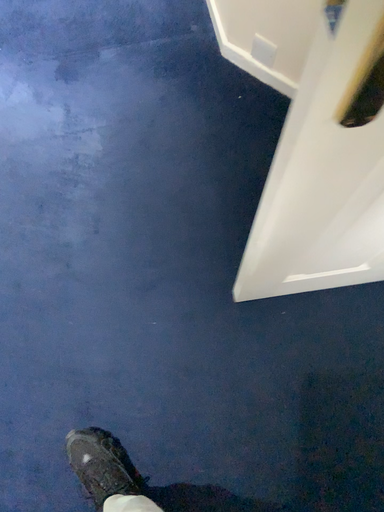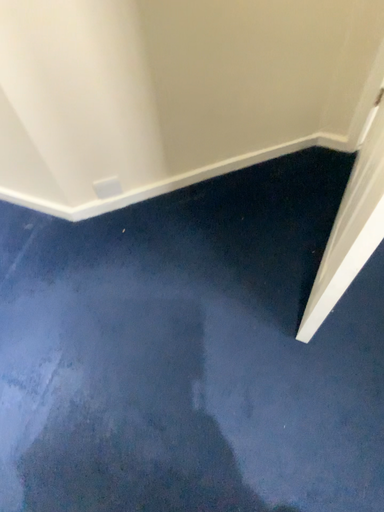
Question: Which way did the camera rotate in the video?

Choices:
 (A) rotated upward
 (B) rotated downward

Answer: (A)